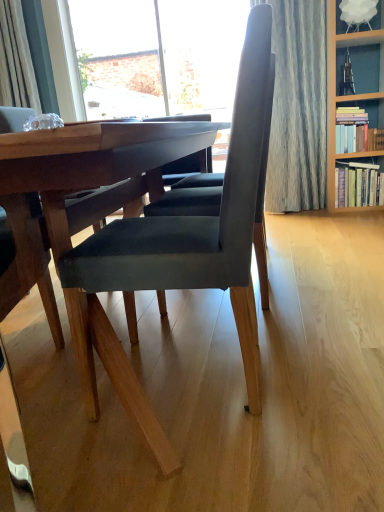
Image resolution: width=384 pixels, height=512 pixels. What are the coordinates of `vacant area on top of hardcover books at upper right, arranged as the 2th book when ordered from the bottom (from a real-world perspective)` in the screenshot? It's located at (357, 105).